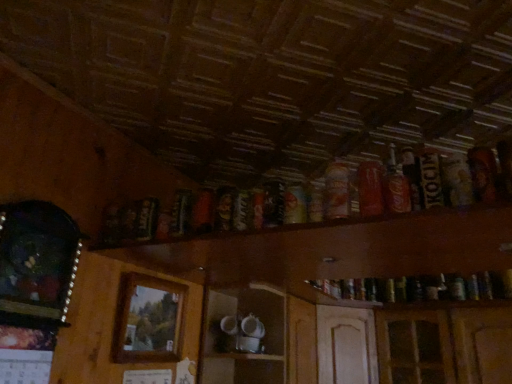
Question: Considering the positions of dark brown glass bottle at left, positioned as the eighth beer in right-to-left order, and wooden picture frame at left, the 1th picture frame in the front-to-back sequence, in the image, is dark brown glass bottle at left, positioned as the eighth beer in right-to-left order, wider or thinner than wooden picture frame at left, the 1th picture frame in the front-to-back sequence,?

Choices:
 (A) wide
 (B) thin

Answer: (B)

Question: In the image, is dark brown glass bottle at left, positioned as the eighth beer in right-to-left order, positioned in front of or behind wooden picture frame at left, which ranks as the first picture frame in left-to-right order?

Choices:
 (A) behind
 (B) front

Answer: (A)

Question: Estimate the real-world distances between objects in this image. Which object is closer to the shiny metallic can at upper center, the 4th beer from the left?

Choices:
 (A) matte orange can at upper center, the 5th beer positioned from the left
 (B) wooden picture frame at left, which is the second picture frame in right-to-left order
 (C) dark brown glass bottle at left, positioned as the eighth beer in right-to-left order
 (D) dark brown glass bottle at upper center, the 6th beer positioned from the right
 (E) wooden shelf at upper center

Answer: (D)

Question: Which of these objects is positioned farthest from the matte red can at upper right, which ranks as the 7th beer in left-to-right order?

Choices:
 (A) dark brown glass bottle at upper center, the 6th beer positioned from the right
 (B) matte orange can at upper center, the 5th beer positioned from the left
 (C) dark brown cardboard beer can at upper right, which appears as the eighth beer when viewed from the left
 (D) wooden picture frame at left, which is the second picture frame in right-to-left order
 (E) wooden frame at center, the 1th picture frame positioned from the right

Answer: (E)